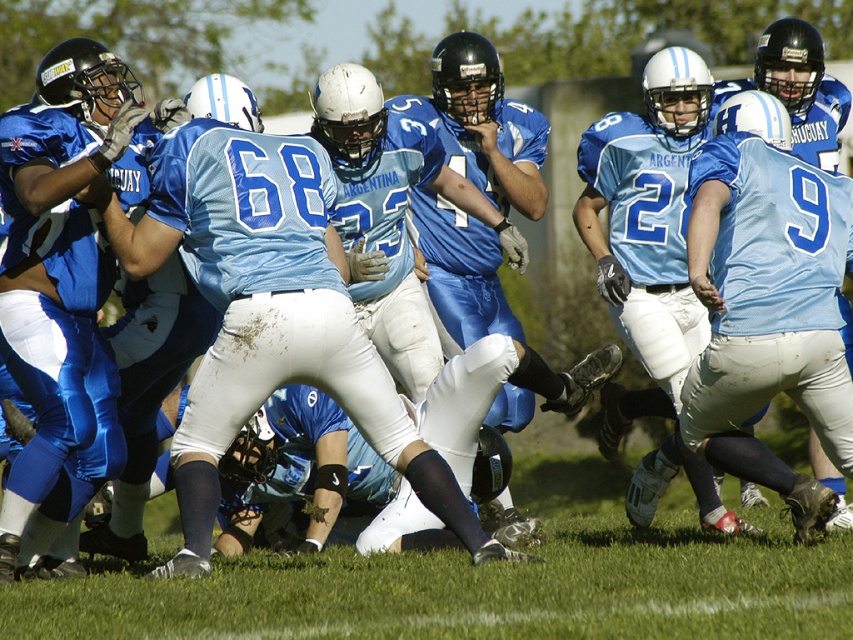
Question: Which of the following is the closest to the observer?

Choices:
 (A) light blue fabric jersey at center
 (B) matte blue jersey at center

Answer: (A)

Question: Is light blue fabric jersey at center to the left of matte blue jersey at center from the viewer's perspective?

Choices:
 (A) yes
 (B) no

Answer: (B)

Question: Is light blue fabric jersey at center above matte blue jersey at center?

Choices:
 (A) no
 (B) yes

Answer: (A)

Question: Does light blue fabric jersey at center appear on the left side of matte blue jersey at center?

Choices:
 (A) no
 (B) yes

Answer: (A)

Question: Among these points, which one is nearest to the camera?

Choices:
 (A) (33, 179)
 (B) (96, 205)

Answer: (A)

Question: Among these points, which one is farthest from the camera?

Choices:
 (A) (357, 413)
 (B) (77, 93)

Answer: (B)